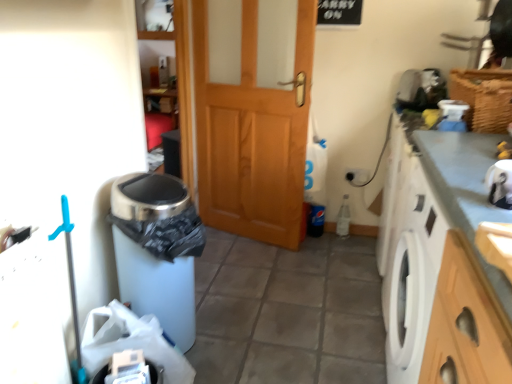
Question: Is there a large distance between wooden door at center and smooth gray countertop at right?

Choices:
 (A) no
 (B) yes

Answer: (B)

Question: Is wooden door at center wider than smooth gray countertop at right?

Choices:
 (A) yes
 (B) no

Answer: (B)

Question: Does wooden door at center touch smooth gray countertop at right?

Choices:
 (A) yes
 (B) no

Answer: (B)

Question: From a real-world perspective, is wooden door at center physically above smooth gray countertop at right?

Choices:
 (A) yes
 (B) no

Answer: (A)

Question: Does wooden door at center have a lesser height compared to smooth gray countertop at right?

Choices:
 (A) yes
 (B) no

Answer: (B)

Question: Visually, is wooden door at center positioned to the left or to the right of white matte trash can at lower left?

Choices:
 (A) right
 (B) left

Answer: (B)

Question: From the image's perspective, is wooden door at center above or below white matte trash can at lower left?

Choices:
 (A) below
 (B) above

Answer: (B)

Question: Considering the positions of wooden door at center and white matte trash can at lower left in the image, is wooden door at center wider or thinner than white matte trash can at lower left?

Choices:
 (A) wide
 (B) thin

Answer: (B)

Question: Looking at the image, does wooden door at center seem bigger or smaller compared to white matte trash can at lower left?

Choices:
 (A) small
 (B) big

Answer: (B)

Question: From the image's perspective, is white plastic bag at lower left located above or below smooth gray countertop at right?

Choices:
 (A) below
 (B) above

Answer: (A)

Question: Which is correct: white plastic bag at lower left is inside smooth gray countertop at right, or outside of it?

Choices:
 (A) inside
 (B) outside

Answer: (B)

Question: Is white plastic bag at lower left in front of or behind smooth gray countertop at right in the image?

Choices:
 (A) behind
 (B) front

Answer: (A)

Question: Based on their sizes in the image, would you say white plastic bag at lower left is bigger or smaller than smooth gray countertop at right?

Choices:
 (A) big
 (B) small

Answer: (B)

Question: Choose the correct answer: Is wooden door at center inside smooth gray countertop at right or outside it?

Choices:
 (A) outside
 (B) inside

Answer: (A)

Question: From the image's perspective, is wooden door at center located above or below smooth gray countertop at right?

Choices:
 (A) above
 (B) below

Answer: (A)